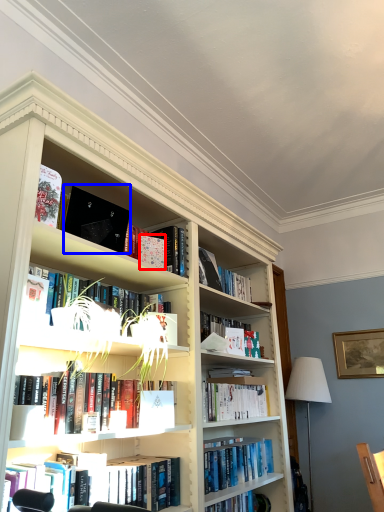
Question: Which object is further to the camera taking this photo, paperback book (highlighted by a red box) or paperback book (highlighted by a blue box)?

Choices:
 (A) paperback book
 (B) paperback book

Answer: (A)